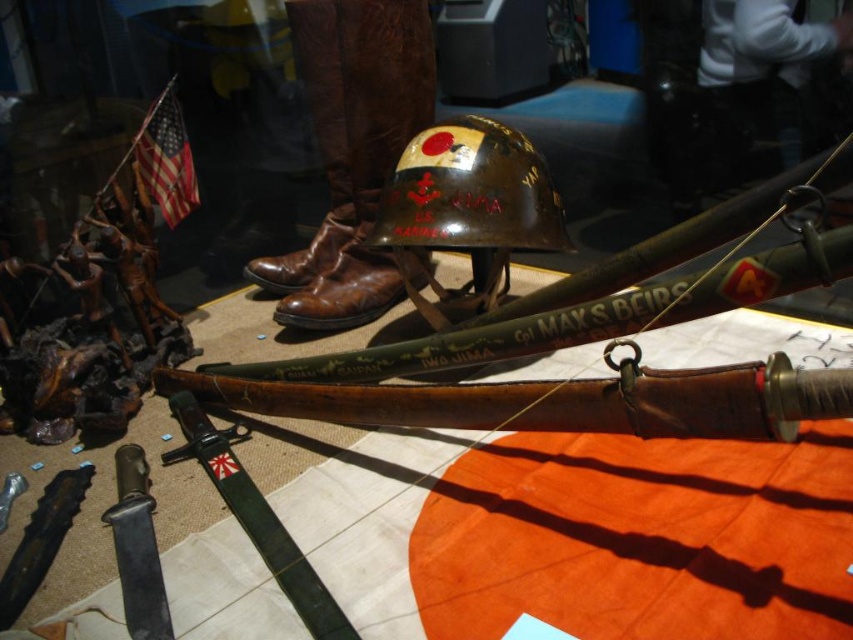
You are a museum curator arranging an exhibit. You have a shiny brown helmet at center and a green leather sword at center. Which object has a greater width?

The shiny brown helmet at center might be wider than the green leather sword at center according to the description.

You are a museum curator arranging an exhibit. You need to place the shiny brown helmet at center and the green leather sword at center on a shelf. Which object should you place first to ensure they both fit vertically?

The shiny brown helmet at center is much taller than the green leather sword at center, so you should place the shiny brown helmet at center first to accommodate its height.

You are a museum curator planning to place a protective glass cover over the shiny brown helmet at center and the matte black knife at lower left. The glass cover has a minimum required distance of 30 inches between the two items to ensure proper coverage. Based on their current positions, will the glass cover work as intended?

The shiny brown helmet at center is 32.10 inches from the matte black knife at lower left, which exceeds the minimum required distance of 30 inches. Therefore, the glass cover will work as intended.